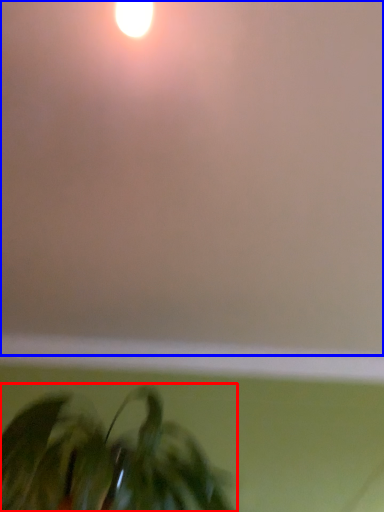
Question: Which object is further to the camera taking this photo, houseplant (highlighted by a red box) or backdrop (highlighted by a blue box)?

Choices:
 (A) houseplant
 (B) backdrop

Answer: (A)